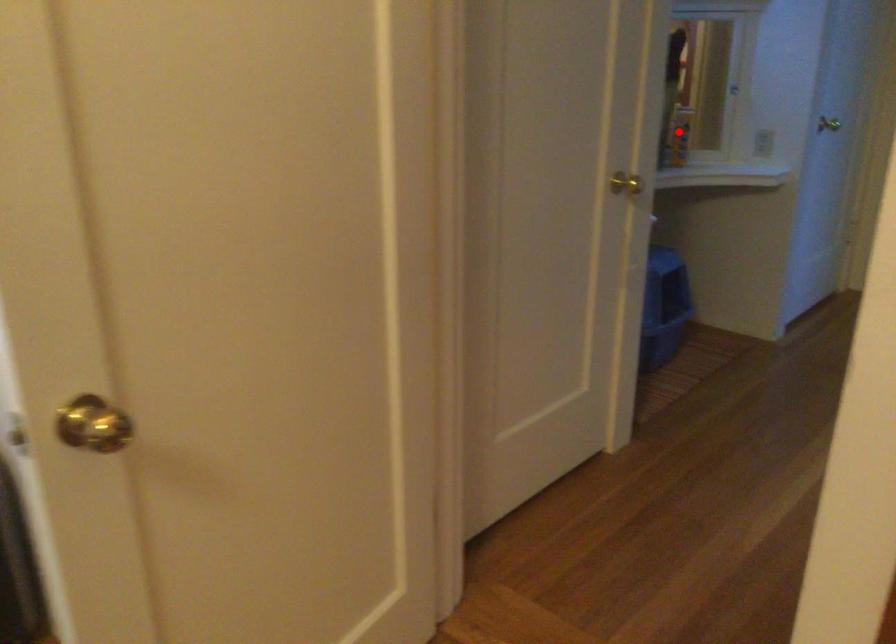
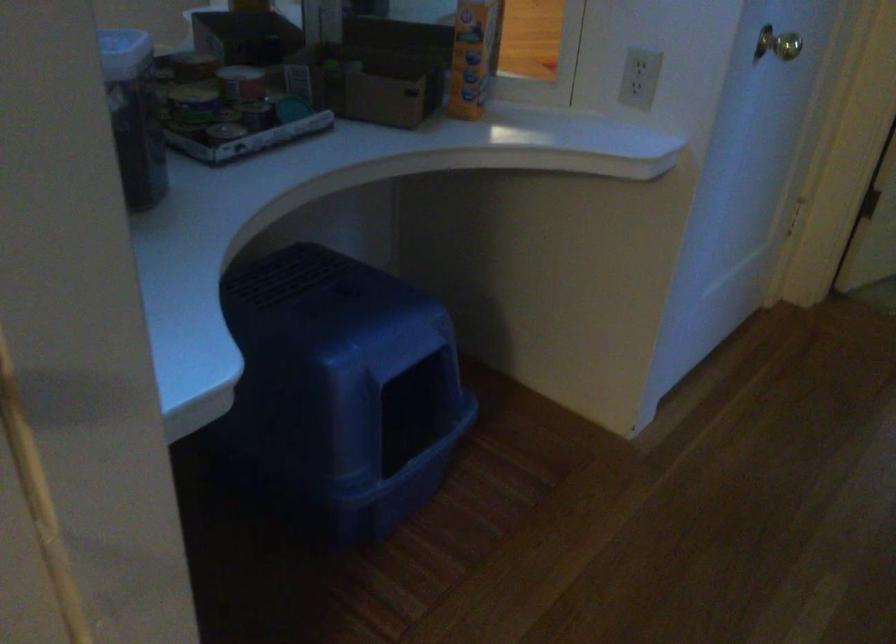
Question: A red point is marked in image1. In image2, is the corresponding 3D point closer to the camera or farther? Reply with the corresponding letter.

Choices:
 (A) The corresponding 3D point is closer.
 (B) The corresponding 3D point is farther.

Answer: (A)